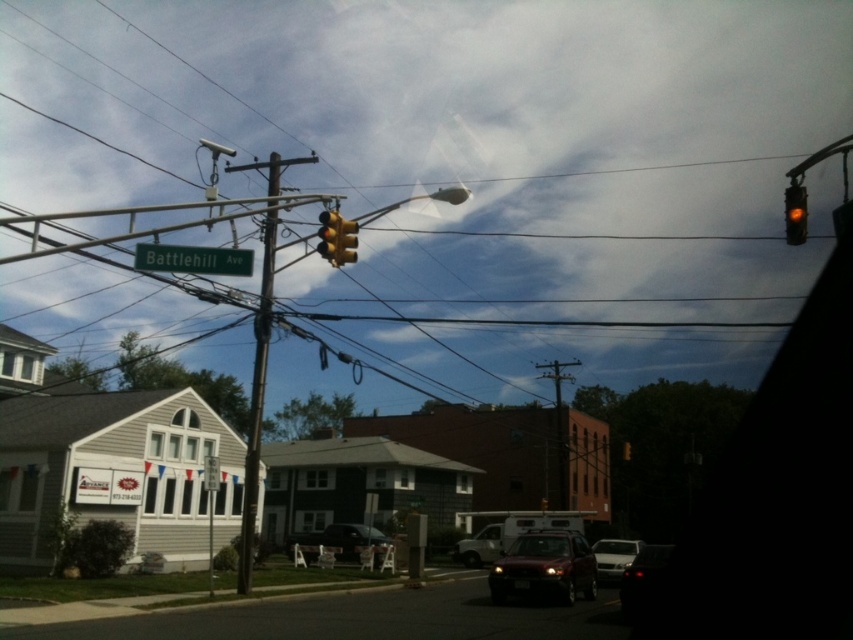
Does point (563, 596) come farther from viewer compared to point (339, 225)?

Yes.

Image resolution: width=853 pixels, height=640 pixels. I want to click on shiny maroon suv at center, so click(x=544, y=566).

From the picture: Can you confirm if green metallic street sign at upper center is taller than yellow matte traffic light at upper right?

No.

Does green metallic street sign at upper center lie behind yellow matte traffic light at upper right?

No, green metallic street sign at upper center is closer to the viewer.

Image resolution: width=853 pixels, height=640 pixels. Describe the element at coordinates (193, 259) in the screenshot. I see `green metallic street sign at upper center` at that location.

Identify the location of green metallic street sign at upper center. (193, 259).

Does white plastic street light at upper center appear over white matte sedan at center?

Yes, white plastic street light at upper center is above white matte sedan at center.

Who is shorter, white plastic street light at upper center or white matte sedan at center?

white matte sedan at center is shorter.

You are a GUI agent. You are given a task and a screenshot of the screen. Output one action in this format:
    pyautogui.click(x=<x>, y=<y>)
    Task: Click on the white plastic street light at upper center
    
    Given the screenshot: What is the action you would take?
    pyautogui.click(x=419, y=202)